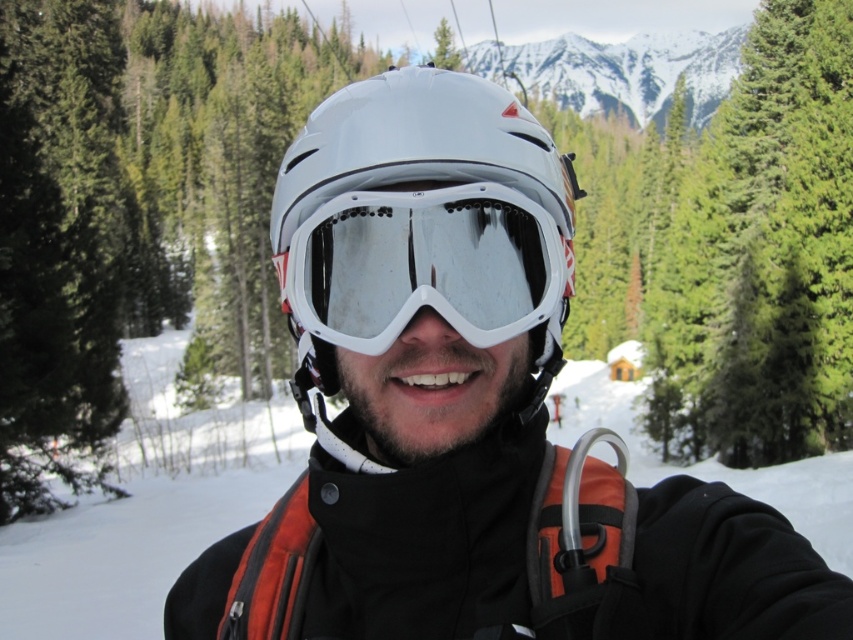
Measure the distance between point (315,275) and camera.

They are 3.22 meters apart.

Who is more forward, (465,225) or (440,298)?

Point (440,298) is more forward.

You are a GUI agent. You are given a task and a screenshot of the screen. Output one action in this format:
    pyautogui.click(x=<x>, y=<y>)
    Task: Click on the white matte helmet at center
    This screenshot has height=640, width=853.
    Given the screenshot: What is the action you would take?
    pyautogui.click(x=419, y=228)